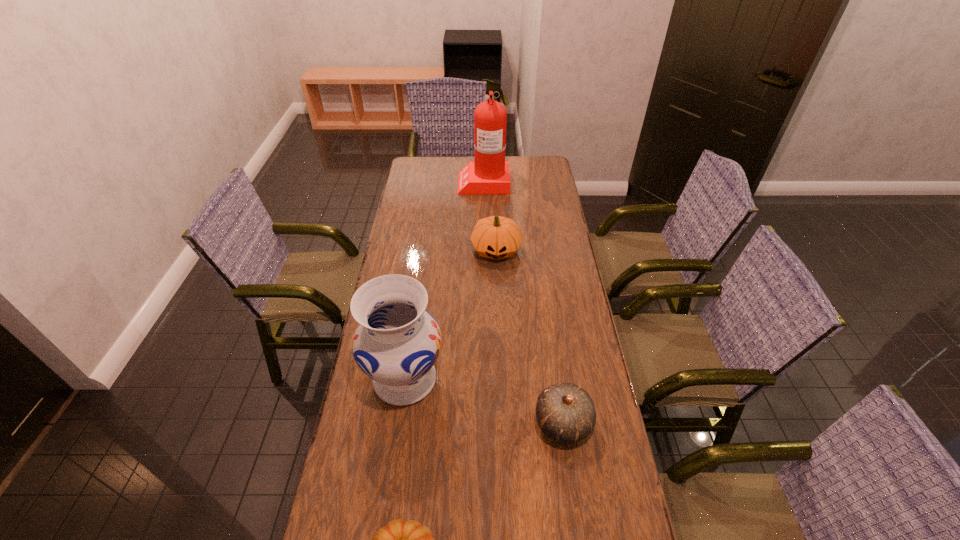
Locate an element on the screen. This screenshot has width=960, height=540. free space located 0.230m on the back of the fourth shortest object is located at coordinates (417, 296).

At what (x,y) coordinates should I click in order to perform the action: click on vacant space located on the side of the farthest gourd with the carved face. Please return your answer as a coordinate pair (x, y). Image resolution: width=960 pixels, height=540 pixels. Looking at the image, I should click on (499, 327).

Where is `vacant space located 0.080m on the front of the second shortest gourd`? The height and width of the screenshot is (540, 960). vacant space located 0.080m on the front of the second shortest gourd is located at coordinates (571, 481).

The width and height of the screenshot is (960, 540). I want to click on object present at the far edge, so click(489, 173).

Identify the location of object that is at the left edge. (397, 342).

Image resolution: width=960 pixels, height=540 pixels. I want to click on object located in the right edge section of the desktop, so click(566, 413).

What are the coordinates of `vacant space at the far edge` in the screenshot? It's located at (511, 177).

At what (x,y) coordinates should I click in order to perform the action: click on free region at the left edge of the desktop. Please return your answer as a coordinate pair (x, y). Looking at the image, I should click on (406, 230).

You are a GUI agent. You are given a task and a screenshot of the screen. Output one action in this format:
    pyautogui.click(x=<x>, y=<y>)
    Task: Click on the free space at the right edge of the desktop
    
    Given the screenshot: What is the action you would take?
    pyautogui.click(x=558, y=294)

Locate an element on the screen. Image resolution: width=960 pixels, height=540 pixels. free space at the far left corner is located at coordinates click(409, 164).